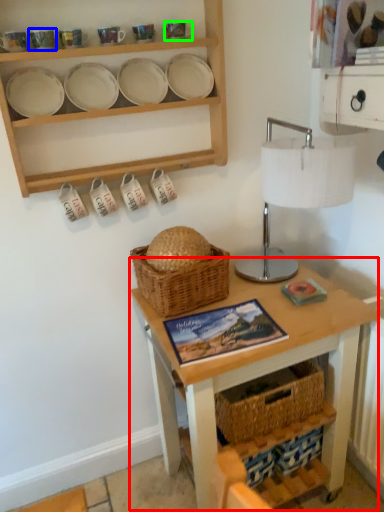
Question: Based on their relative distances, which object is farther from table (highlighted by a red box)? Choose from tableware (highlighted by a blue box) and tableware (highlighted by a green box).

Choices:
 (A) tableware
 (B) tableware

Answer: (A)